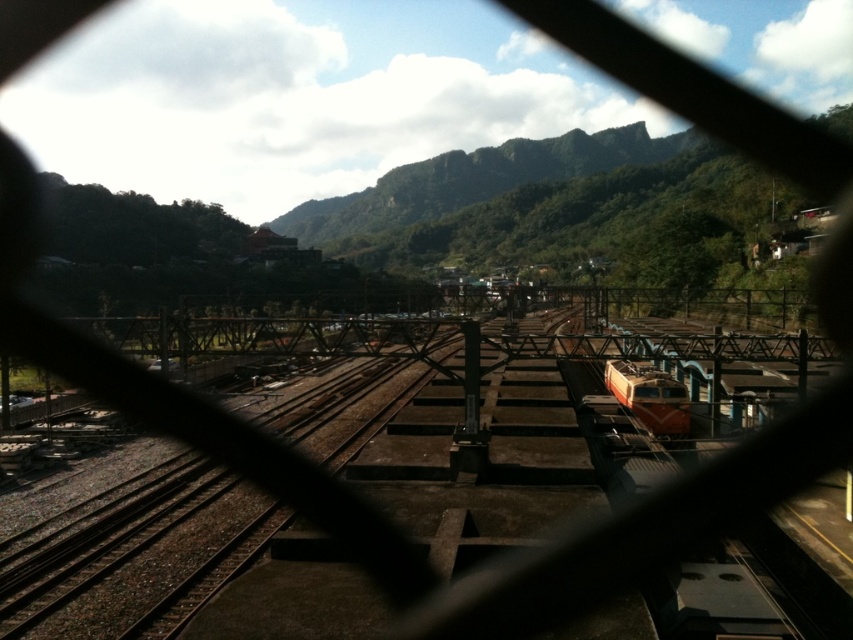
You are a railway engineer assessing the safety of the tracks. You notice the rusty metal train track at center and the orange metallic train at center. Which object has a greater width?

The rusty metal train track at center has a greater width than the orange metallic train at center according to the description.

You are standing in front of the window and see two points marked on the glass. One is at point (97,380) and the other at point (611,358). Which point is closer to you?

Point (97,380) is closer to you because it is further to the viewer than point (611,358).